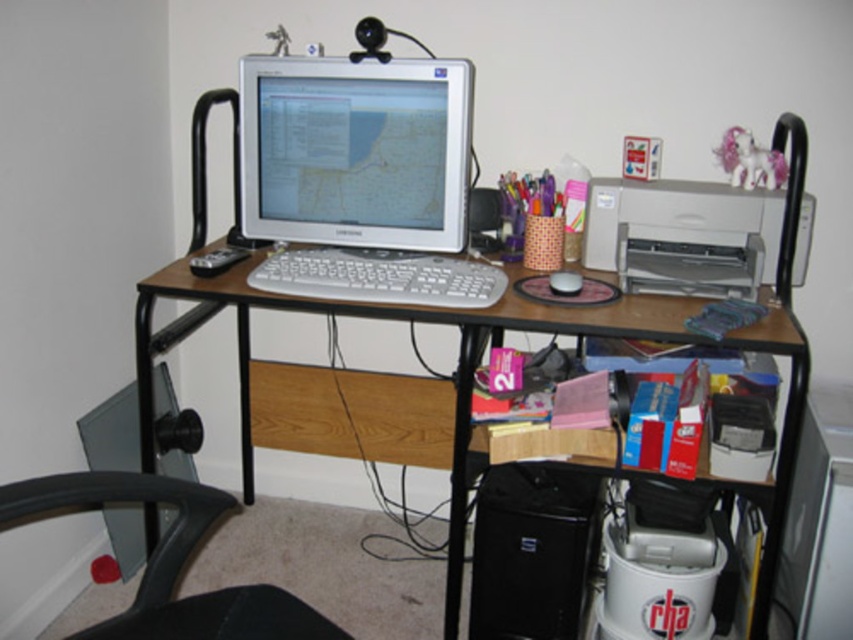
Question: Is brown wooden table at center to the right of white plastic keyboard at center from the viewer's perspective?

Choices:
 (A) no
 (B) yes

Answer: (B)

Question: Which of the following is the farthest from the observer?

Choices:
 (A) brown wooden table at center
 (B) white matte mouse at center
 (C) white plastic keyboard at center
 (D) black plastic swivel chair at lower left

Answer: (B)

Question: Can you confirm if brown wooden table at center is wider than black plastic swivel chair at lower left?

Choices:
 (A) yes
 (B) no

Answer: (A)

Question: Is white plastic keyboard at center closer to camera compared to white matte mouse at center?

Choices:
 (A) yes
 (B) no

Answer: (A)

Question: Which object is closer to the camera taking this photo?

Choices:
 (A) silver metallic monitor at center
 (B) white matte mouse at center
 (C) brown wooden table at center
 (D) white plastic keyboard at center

Answer: (C)

Question: Among these objects, which one is farthest from the camera?

Choices:
 (A) white plastic keyboard at center
 (B) silver metallic monitor at center
 (C) brown wooden table at center
 (D) black plastic swivel chair at lower left

Answer: (B)